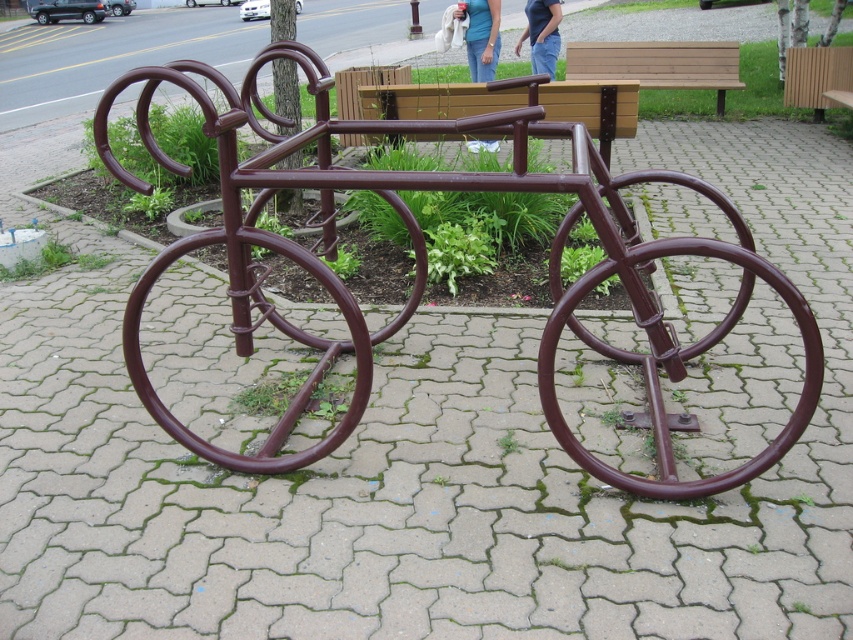
Question: In this image, where is brown metallic bicycle at center located relative to brown wood bench at center?

Choices:
 (A) left
 (B) right

Answer: (A)

Question: Estimate the real-world distances between objects in this image. Which object is closer to the wooden bench at upper center?

Choices:
 (A) blue jeans at upper center
 (B) brown wood bench at center

Answer: (A)

Question: Is the position of brown metallic bicycle at center less distant than that of brown wood bench at center?

Choices:
 (A) yes
 (B) no

Answer: (A)

Question: Is brown wood bench at center wider than blue denim jeans at center?

Choices:
 (A) yes
 (B) no

Answer: (A)

Question: Among these points, which one is nearest to the camera?

Choices:
 (A) (476, 17)
 (B) (814, 106)

Answer: (A)

Question: Which object is closer to the camera taking this photo?

Choices:
 (A) brown wooden bench at upper right
 (B) blue denim jeans at center
 (C) blue jeans at upper center
 (D) wooden bench at upper center

Answer: (B)